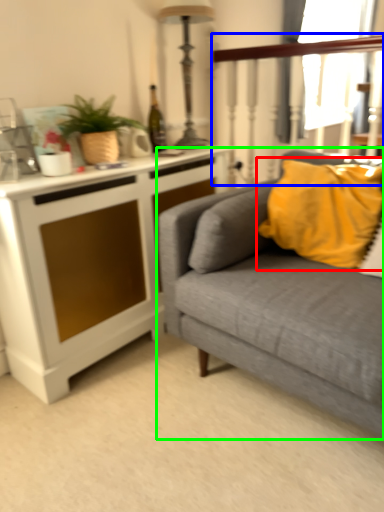
Question: Estimate the real-world distances between objects in this image. Which object is farther from pillow (highlighted by a red box), rail (highlighted by a blue box) or studio couch (highlighted by a green box)?

Choices:
 (A) rail
 (B) studio couch

Answer: (A)